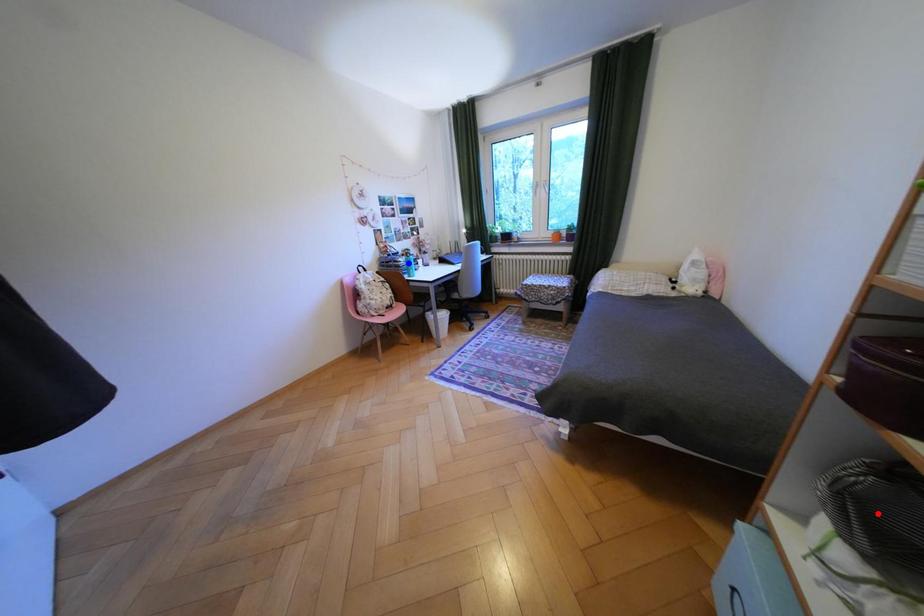
Question: In the image, two points are highlighted. Which point is nearer to the camera? Reply with the corresponding letter.

Choices:
 (A) blue point
 (B) red point

Answer: (B)